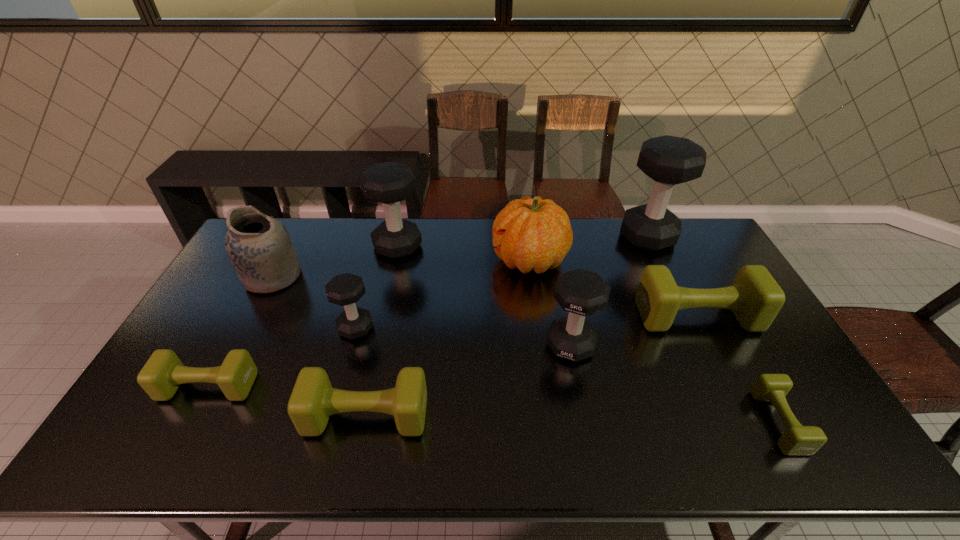
Where is `the rightmost gray dumbbell`? the rightmost gray dumbbell is located at coordinates (668, 160).

At what (x,y) coordinates should I click in order to perform the action: click on the tallest dumbbell. Please return your answer as a coordinate pair (x, y). The image size is (960, 540). Looking at the image, I should click on (668, 160).

At what (x,y) coordinates should I click in order to perform the action: click on the second tallest dumbbell. Please return your answer as a coordinate pair (x, y). The image size is (960, 540). Looking at the image, I should click on (389, 183).

Where is `orange pumpkin`? orange pumpkin is located at coordinates point(530,234).

Where is `pottery`? This screenshot has height=540, width=960. pottery is located at coordinates (259, 247).

Where is `the second gray dumbbell from right to left`? This screenshot has width=960, height=540. the second gray dumbbell from right to left is located at coordinates (580, 292).

Identify the location of the sixth shortest dumbbell. (580, 292).

Where is `the smallest gray dumbbell`? Image resolution: width=960 pixels, height=540 pixels. the smallest gray dumbbell is located at coordinates (346, 289).

I want to click on the seventh tallest object, so click(755, 298).

Locate an element on the screen. the biggest olive dumbbell is located at coordinates (755, 298).